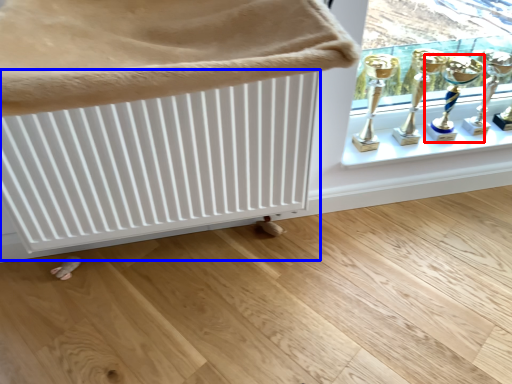
Question: Which of the following is the farthest to the observer, candle holder (highlighted by a red box) or radiator (highlighted by a blue box)?

Choices:
 (A) candle holder
 (B) radiator

Answer: (A)